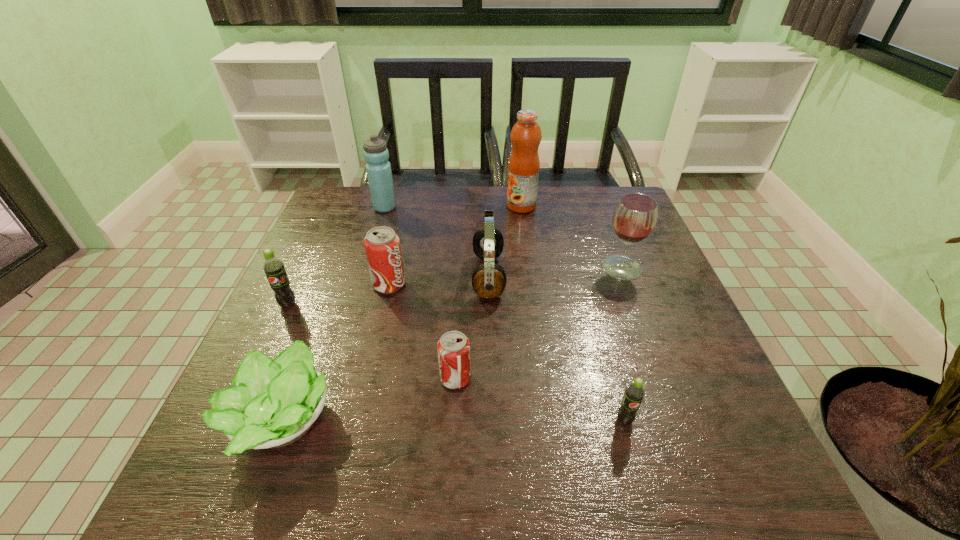
Image resolution: width=960 pixels, height=540 pixels. What are the coordinates of `blank space located 0.260m on the ear cups of the headset` in the screenshot? It's located at (367, 276).

This screenshot has width=960, height=540. Identify the location of vacant space located 0.310m on the ear cups of the headset. (347, 276).

Image resolution: width=960 pixels, height=540 pixels. What are the coordinates of `vacant position located 0.280m on the ear cups of the headset` in the screenshot? It's located at (358, 276).

Identify the location of free point located 0.140m on the front label of the leftmost soda. (262, 361).

Find the location of `blank space located 0.190m on the left of the farther pink soda can`. blank space located 0.190m on the left of the farther pink soda can is located at coordinates click(294, 285).

At what (x,y) coordinates should I click in order to perform the action: click on free space located on the left of the right pink soda can. Please return your answer as a coordinate pair (x, y). The height and width of the screenshot is (540, 960). Looking at the image, I should click on (337, 379).

Where is `vacant area situated 0.050m on the front label of the right green soda`? vacant area situated 0.050m on the front label of the right green soda is located at coordinates (635, 455).

At what (x,y) coordinates should I click in order to perform the action: click on vacant region located 0.230m on the right of the green lettuce. Please return your answer as a coordinate pair (x, y). This screenshot has width=960, height=540. Looking at the image, I should click on (462, 422).

The image size is (960, 540). Identify the location of fruit juice that is at the far edge. (523, 168).

The height and width of the screenshot is (540, 960). I want to click on water bottle positioned at the far edge, so click(378, 168).